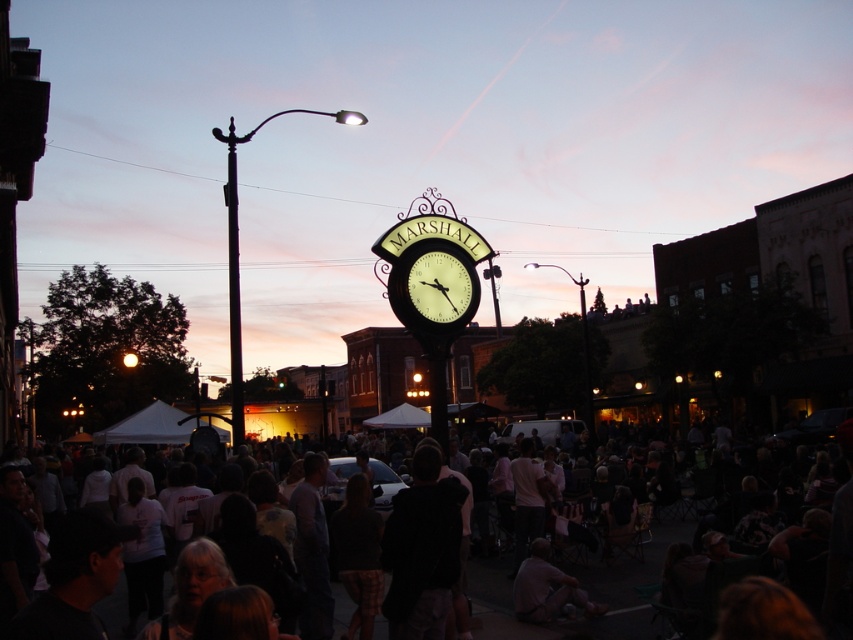
Who is higher up, dark clothing crowd at center or matte black clock at center?

matte black clock at center is above.

Identify the location of dark clothing crowd at center. This screenshot has height=640, width=853. (747, 484).

Does metallic pole at center-left have a lesser height compared to matte black clock at center?

No.

Is point (239, 422) closer to camera compared to point (459, 260)?

Yes.

The height and width of the screenshot is (640, 853). In order to click on metallic pole at center-left in this screenshot , I will do `click(233, 284)`.

Find the location of a particular element. This screenshot has height=640, width=853. dark clothing crowd at center is located at coordinates (747, 484).

Is point (784, 496) less distant than point (233, 346)?

No, it is not.

What are the coordinates of `dark clothing crowd at center` in the screenshot? It's located at (747, 484).